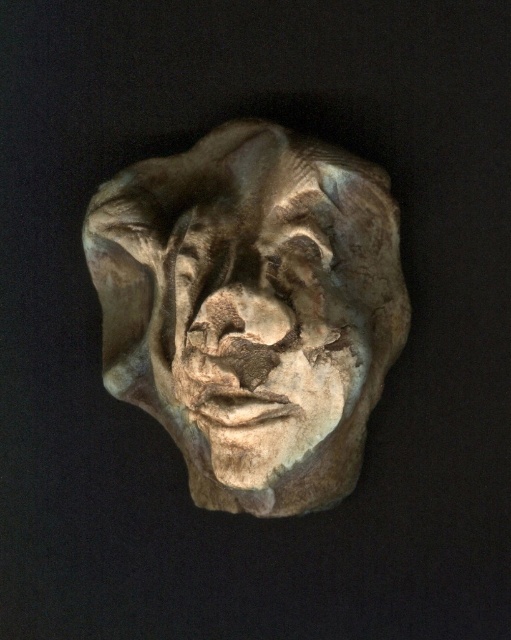
You are an art conservator examining the sculpture. You need to place a protective barrier around the matte stone face at center. What are the coordinates where you should position the barrier?

The matte stone face at center is located at coordinates point (251,308), so you should position the barrier around that point.

You are an art installer who needs to place a 4 feet long beam between the two eyes of the matte stone face at center. Is there enough space between them?

The distance between the two eyes of the matte stone face at center is 3.93 feet, which is less than the 4 feet long beam. Therefore, the beam cannot fit between them.

You are an art conservator working with a 1.5 inch wide tool. You need to place it between the matte stone face at center and the rustic stone face at center. Is there enough space for the tool to fit between them?

The matte stone face at center and rustic stone face at center are 0.55 inches apart, so the 1.5 inch wide tool cannot fit between them as the space is narrower than the tool.